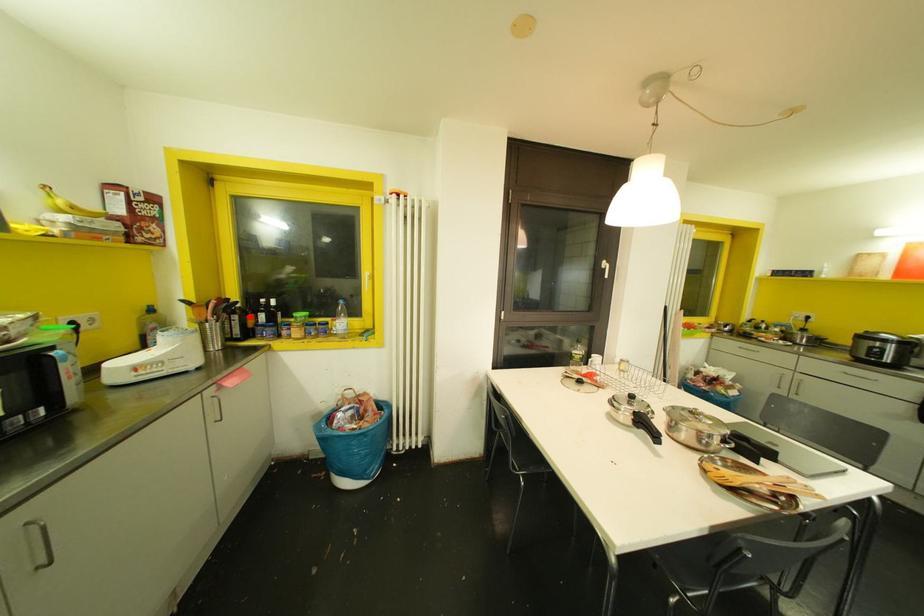
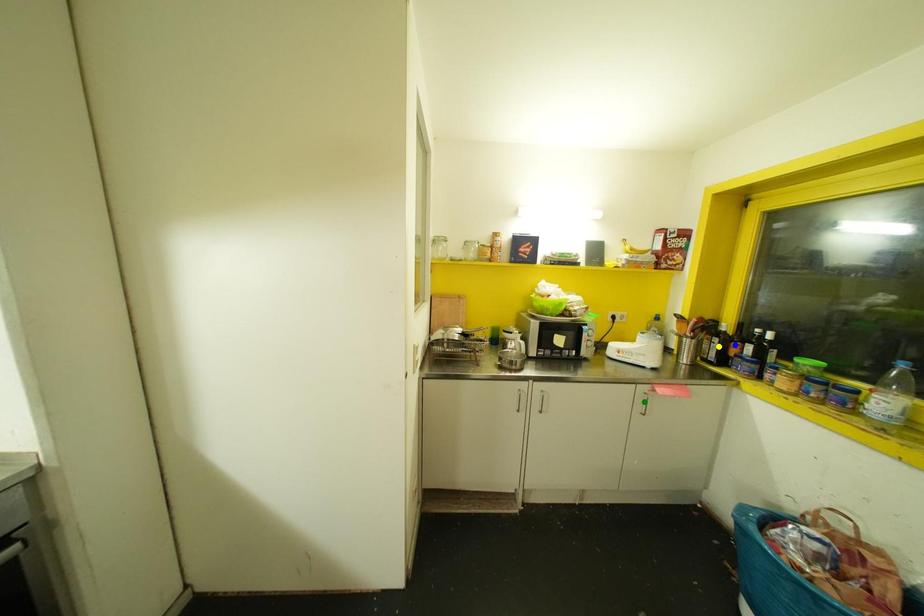
Question: I am providing you with two images of the same scene from different viewpoints. A red point is marked on the first image. You are given multiple points on the second image. Which point in image 2 represents the same 3d spot as the red point in image 1?

Choices:
 (A) blue point
 (B) yellow point
 (C) green point

Answer: (A)